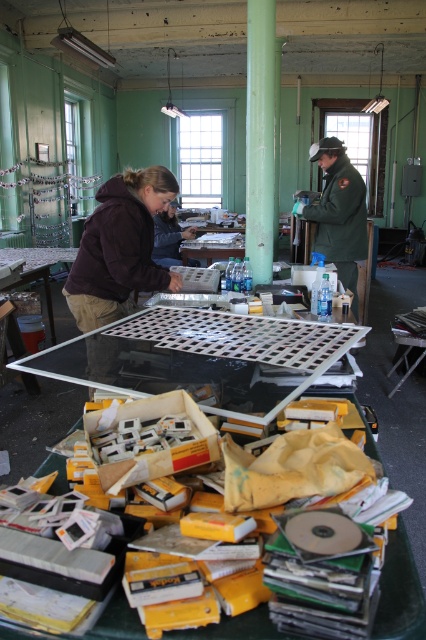
Question: Does dark brown hoodie at center have a larger size compared to brown fabric jacket at upper center?

Choices:
 (A) no
 (B) yes

Answer: (B)

Question: Which object appears farthest from the camera in this image?

Choices:
 (A) green uniform at center
 (B) brown fabric jacket at upper center

Answer: (B)

Question: Considering the real-world distances, which object is closest to the green uniform at center?

Choices:
 (A) dark brown hoodie at center
 (B) brown fabric jacket at upper center

Answer: (B)

Question: Which of the following is the closest to the observer?

Choices:
 (A) (164, 252)
 (B) (336, 209)
 (C) (104, 294)

Answer: (C)

Question: Does green uniform at center appear over brown fabric jacket at upper center?

Choices:
 (A) yes
 (B) no

Answer: (B)

Question: From the image, what is the correct spatial relationship of green uniform at center in relation to brown fabric jacket at upper center?

Choices:
 (A) right
 (B) left

Answer: (A)